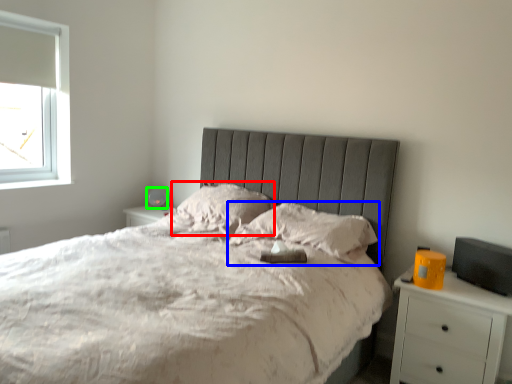
Question: Estimate the real-world distances between objects in this image. Which object is closer to pillow (highlighted by a red box), pillow (highlighted by a blue box) or table lamp (highlighted by a green box)?

Choices:
 (A) pillow
 (B) table lamp

Answer: (A)